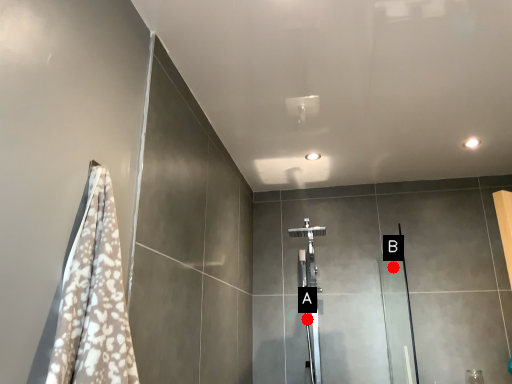
Question: Two points are circled on the image, labeled by A and B beside each circle. Which point is farther to the camera?

Choices:
 (A) A is further
 (B) B is further

Answer: (B)